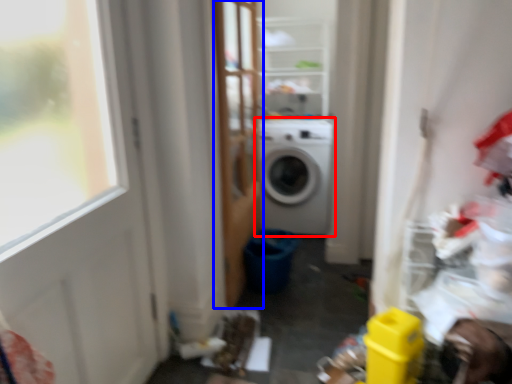
Question: Which of the following is the closest to the observer, washing machine (highlighted by a red box) or screen door (highlighted by a blue box)?

Choices:
 (A) washing machine
 (B) screen door

Answer: (B)